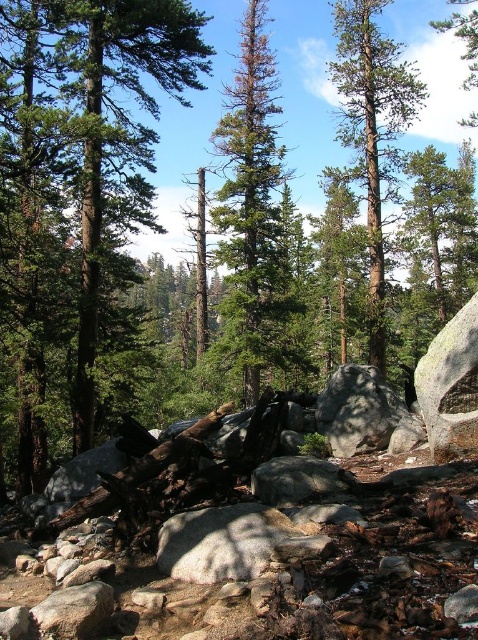
Question: Which object appears closest to the camera in this image?

Choices:
 (A) green textured tree at center
 (B) green textured pine tree at center
 (C) green leafy tree at center

Answer: (C)

Question: Is green textured pine tree at center below green textured tree at center?

Choices:
 (A) yes
 (B) no

Answer: (A)

Question: Can you confirm if green textured pine tree at center is positioned to the right of gray rough boulder at center?

Choices:
 (A) yes
 (B) no

Answer: (A)

Question: Which of the following is the farthest from the observer?

Choices:
 (A) (221, 115)
 (B) (164, 77)

Answer: (A)

Question: Does green textured pine tree at center have a greater width compared to green textured tree at center?

Choices:
 (A) yes
 (B) no

Answer: (B)

Question: Which object appears farthest from the camera in this image?

Choices:
 (A) green textured pine tree at center
 (B) gray rough boulder at center

Answer: (A)